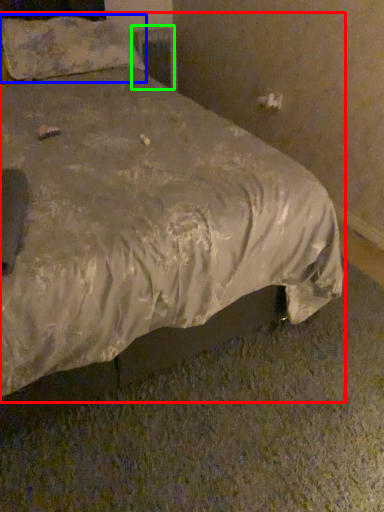
Question: Based on their relative distances, which object is farther from bed (highlighted by a red box)? Choose from pillow (highlighted by a blue box) and radiator (highlighted by a green box).

Choices:
 (A) pillow
 (B) radiator

Answer: (B)